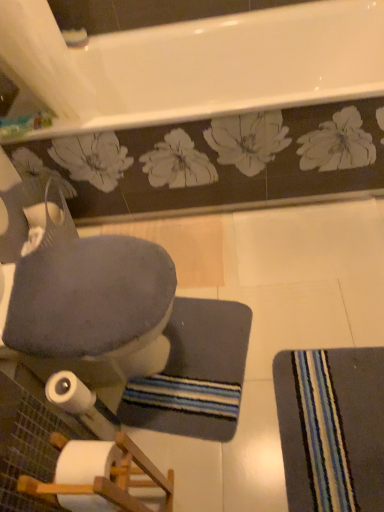
Question: Is striped fabric mat at lower right touching velvet gray rocking chair at lower left?

Choices:
 (A) yes
 (B) no

Answer: (B)

Question: Does striped fabric mat at lower right have a larger size compared to velvet gray rocking chair at lower left?

Choices:
 (A) no
 (B) yes

Answer: (A)

Question: Considering the relative sizes of striped fabric mat at lower right and velvet gray rocking chair at lower left in the image provided, is striped fabric mat at lower right smaller than velvet gray rocking chair at lower left?

Choices:
 (A) yes
 (B) no

Answer: (A)

Question: From a real-world perspective, is striped fabric mat at lower right beneath velvet gray rocking chair at lower left?

Choices:
 (A) yes
 (B) no

Answer: (A)

Question: Does striped fabric mat at lower right appear on the left side of velvet gray rocking chair at lower left?

Choices:
 (A) no
 (B) yes

Answer: (A)

Question: Is striped fabric mat at lower right further to the viewer compared to velvet gray rocking chair at lower left?

Choices:
 (A) no
 (B) yes

Answer: (B)

Question: Can you confirm if velvet gray rocking chair at lower left is shorter than white matte toilet paper at lower left?

Choices:
 (A) no
 (B) yes

Answer: (A)

Question: Is velvet gray rocking chair at lower left outside white matte toilet paper at lower left?

Choices:
 (A) yes
 (B) no

Answer: (A)

Question: Is velvet gray rocking chair at lower left closer to the viewer compared to white matte toilet paper at lower left?

Choices:
 (A) yes
 (B) no

Answer: (A)

Question: Can you confirm if velvet gray rocking chair at lower left is thinner than white matte toilet paper at lower left?

Choices:
 (A) yes
 (B) no

Answer: (B)

Question: From a real-world perspective, is velvet gray rocking chair at lower left positioned under white matte toilet paper at lower left based on gravity?

Choices:
 (A) yes
 (B) no

Answer: (B)

Question: Does velvet gray rocking chair at lower left appear on the right side of white matte toilet paper at lower left?

Choices:
 (A) no
 (B) yes

Answer: (A)

Question: Can you confirm if striped fabric mat at lower right is positioned to the right of dark gray textured bath mat at center?

Choices:
 (A) yes
 (B) no

Answer: (A)